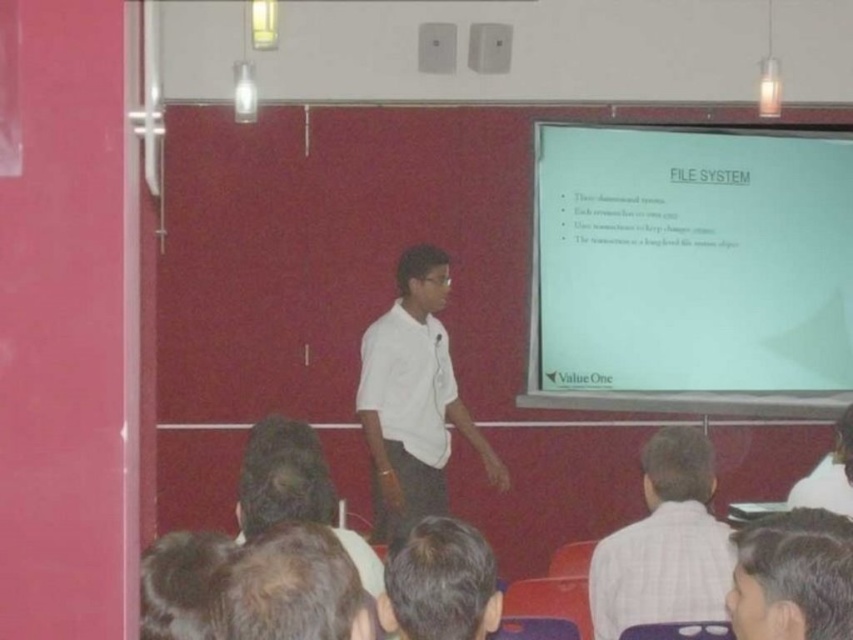
In the classroom scene, you notice the presenter wearing a white matte shirt at center and has brown hair at lower center. Which of these two items is bigger in size?

The white matte shirt at center has a larger size compared to brown hair at lower center.

You are a student sitting in the classroom. You notice two people with brown hair at lower center and dark brown hair at center. Which person is closer to you?

The brown hair at lower center is closer to you because it is in front of dark brown hair at center.

You are sitting in the classroom and looking at the whiteboard. There are two points marked on the whiteboard. Which point is closer to you, point (228, 604) or point (463, 627)?

Point (228, 604) is closer to the viewer than point (463, 627).